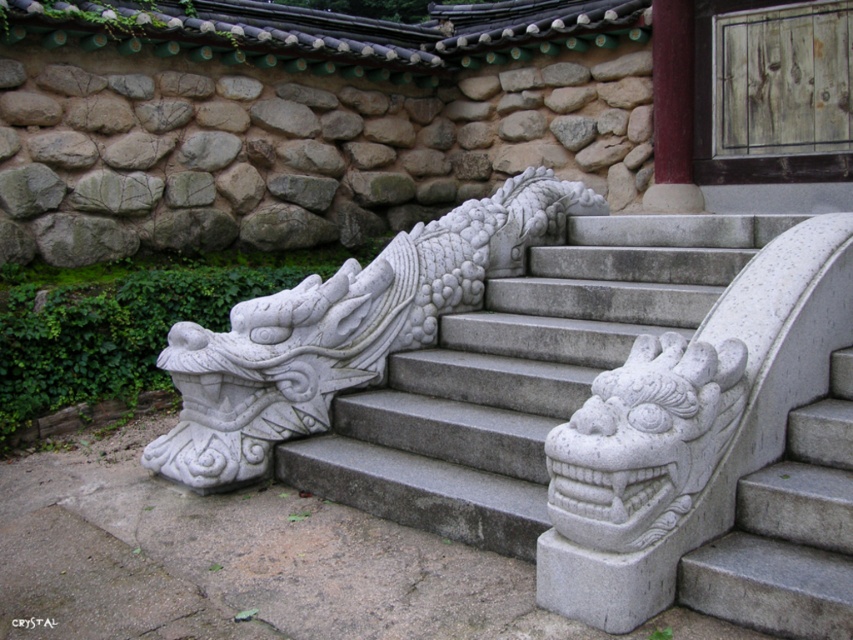
Question: Where is white stone dragon head at upper right located in relation to smooth red wood at upper right in the image?

Choices:
 (A) above
 (B) below

Answer: (B)

Question: Does white stone dragon at lower left appear under white stone dragon head at upper right?

Choices:
 (A) no
 (B) yes

Answer: (A)

Question: Which of the following is the closest to the observer?

Choices:
 (A) white stone dragon at lower left
 (B) gray stone stairs at center
 (C) smooth red wood at upper right

Answer: (B)

Question: Based on their relative distances, which object is nearer to the white stone dragon at lower left?

Choices:
 (A) smooth red wood at upper right
 (B) white stone dragon head at upper right
 (C) gray stone stairs at center

Answer: (C)

Question: Which of the following is the farthest from the observer?

Choices:
 (A) gray stone stairs at center
 (B) white stone dragon at lower left
 (C) white stone dragon head at upper right
 (D) smooth red wood at upper right

Answer: (D)

Question: Does gray stone stairs at center have a greater width compared to white stone dragon head at upper right?

Choices:
 (A) no
 (B) yes

Answer: (B)